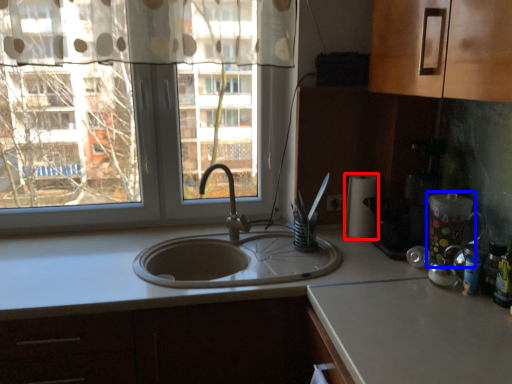
Question: Which object is closer to the camera taking this photo, paper towel (highlighted by a red box) or appliance (highlighted by a blue box)?

Choices:
 (A) paper towel
 (B) appliance

Answer: (B)